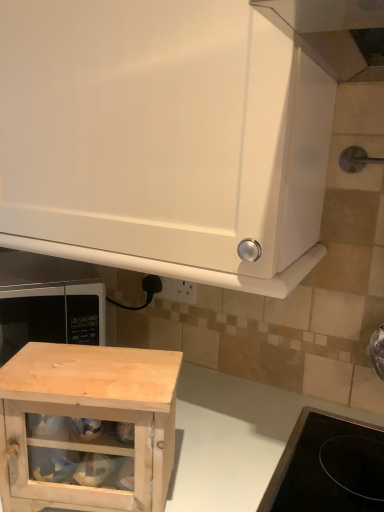
Question: Is natural wood cabinet at lower center closer to the viewer compared to white glossy cabinet at upper center, the first cabinetry from the top?

Choices:
 (A) no
 (B) yes

Answer: (A)

Question: Can we say natural wood cabinet at lower center lies outside white glossy cabinet at upper center, the first cabinetry from the top?

Choices:
 (A) yes
 (B) no

Answer: (A)

Question: Is natural wood cabinet at lower center touching white glossy cabinet at upper center, acting as the 2th cabinetry starting from the bottom?

Choices:
 (A) no
 (B) yes

Answer: (A)

Question: Could you tell me if natural wood cabinet at lower center is facing white glossy cabinet at upper center, acting as the 2th cabinetry starting from the bottom?

Choices:
 (A) yes
 (B) no

Answer: (B)

Question: Considering the relative sizes of natural wood cabinet at lower center and white glossy cabinet at upper center, the first cabinetry from the top, in the image provided, is natural wood cabinet at lower center bigger than white glossy cabinet at upper center, the first cabinetry from the top,?

Choices:
 (A) yes
 (B) no

Answer: (A)

Question: Considering their positions, is natural wood cabinet at lower left, which is counted as the first cabinetry, starting from the bottom, located in front of or behind white plastic electric outlet at lower center?

Choices:
 (A) front
 (B) behind

Answer: (A)

Question: Is natural wood cabinet at lower left, marked as the second cabinetry in a top-to-bottom arrangement, inside or outside of white plastic electric outlet at lower center?

Choices:
 (A) outside
 (B) inside

Answer: (A)

Question: From their relative heights in the image, would you say natural wood cabinet at lower left, marked as the second cabinetry in a top-to-bottom arrangement, is taller or shorter than white plastic electric outlet at lower center?

Choices:
 (A) tall
 (B) short

Answer: (A)

Question: Considering the relative positions of natural wood cabinet at lower left, marked as the second cabinetry in a top-to-bottom arrangement, and white plastic electric outlet at lower center in the image provided, is natural wood cabinet at lower left, marked as the second cabinetry in a top-to-bottom arrangement, to the left or to the right of white plastic electric outlet at lower center?

Choices:
 (A) right
 (B) left

Answer: (B)

Question: Is point (11, 314) closer or farther from the camera than point (66, 442)?

Choices:
 (A) farther
 (B) closer

Answer: (A)

Question: Is black matte microwave at lower left taller or shorter than natural wood cabinet at lower center?

Choices:
 (A) tall
 (B) short

Answer: (B)

Question: From the image's perspective, is black matte microwave at lower left above or below natural wood cabinet at lower center?

Choices:
 (A) above
 (B) below

Answer: (A)

Question: Choose the correct answer: Is black matte microwave at lower left inside natural wood cabinet at lower center or outside it?

Choices:
 (A) outside
 (B) inside

Answer: (A)

Question: Choose the correct answer: Is white glossy cabinet at upper center, acting as the 2th cabinetry starting from the bottom, inside white plastic electric outlet at lower center or outside it?

Choices:
 (A) outside
 (B) inside

Answer: (A)

Question: Is white glossy cabinet at upper center, acting as the 2th cabinetry starting from the bottom, to the left or to the right of white plastic electric outlet at lower center in the image?

Choices:
 (A) left
 (B) right

Answer: (A)